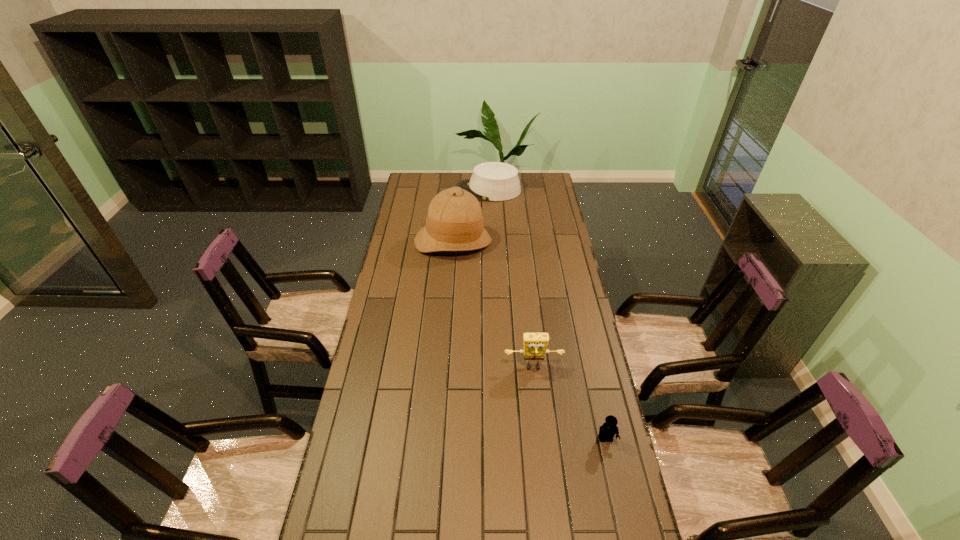
This screenshot has width=960, height=540. In order to click on blank space at the right edge of the desktop in this screenshot , I will do `click(539, 273)`.

Find the location of a particular element. vacant space at the far left corner of the desktop is located at coordinates (433, 181).

The image size is (960, 540). I want to click on vacant space at the far right corner, so click(532, 183).

Identify the location of vacant area between the second tallest object and the shorter hat. (511, 279).

Locate an element on the screen. vacant point located between the sponge and the Lego is located at coordinates (569, 403).

You are a GUI agent. You are given a task and a screenshot of the screen. Output one action in this format:
    pyautogui.click(x=<x>, y=<y>)
    Task: Click on the vacant space in between the taller hat and the second tallest object
    The image size is (960, 540).
    Given the screenshot: What is the action you would take?
    pyautogui.click(x=493, y=305)

Locate an element on the screen. This screenshot has height=540, width=960. vacant space in between the second tallest object and the farthest object is located at coordinates (511, 279).

Locate an element on the screen. The image size is (960, 540). empty space between the sponge and the Lego is located at coordinates (569, 403).

You are a GUI agent. You are given a task and a screenshot of the screen. Output one action in this format:
    pyautogui.click(x=<x>, y=<y>)
    Task: Click on the third closest object to the nearest object
    The image size is (960, 540).
    Given the screenshot: What is the action you would take?
    pyautogui.click(x=492, y=181)

Locate which object is the second closest to the farthest object. Please provide its 2D coordinates. Your answer should be formatted as a tuple, i.e. [(x, y)], where the tuple contains the x and y coordinates of a point satisfying the conditions above.

[(535, 344)]